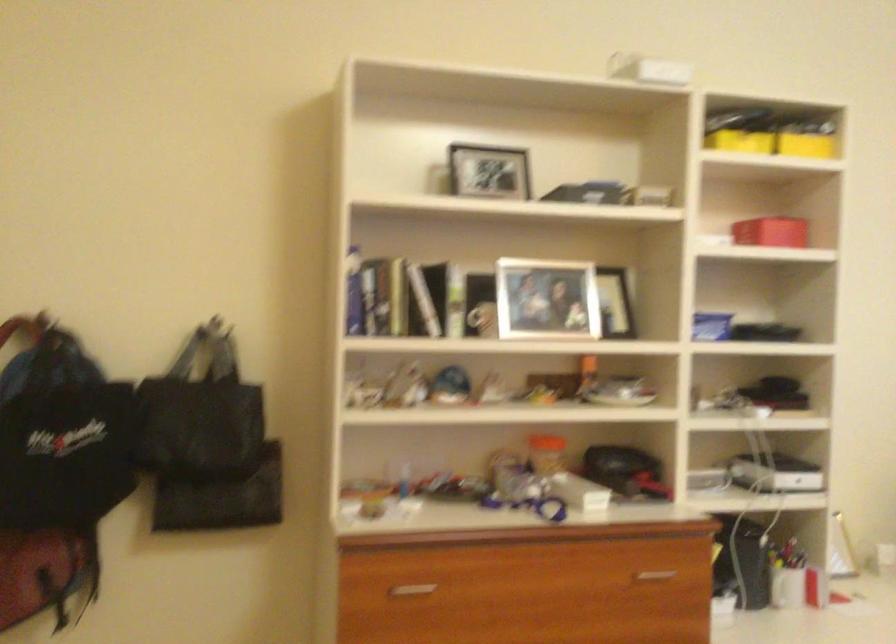
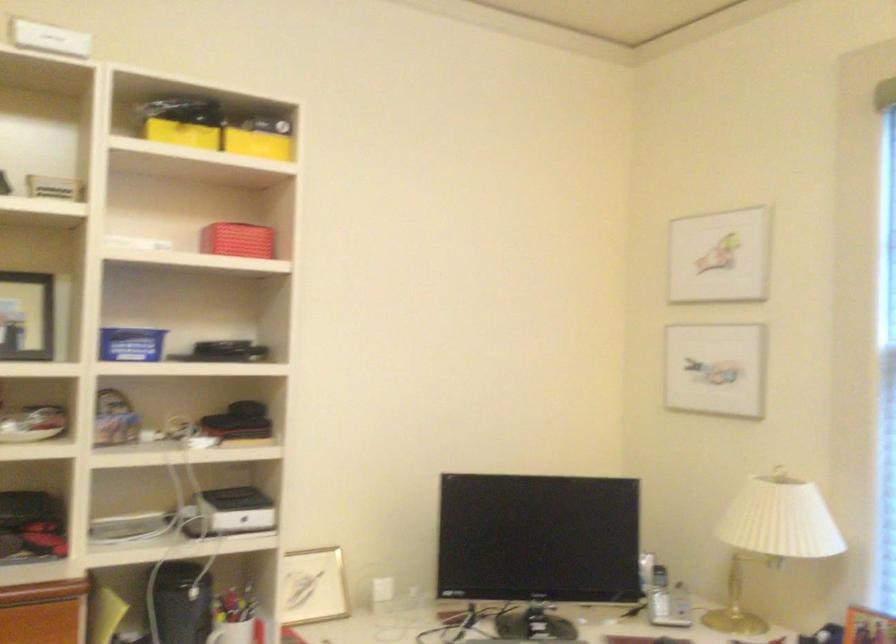
Where in the second image is the point corresponding to (x=778, y=231) from the first image?

(237, 240)